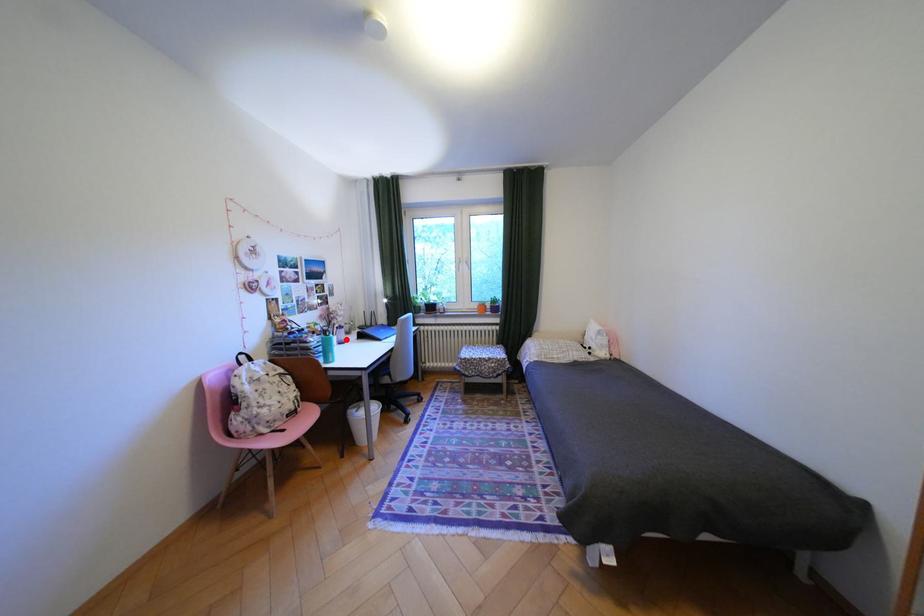
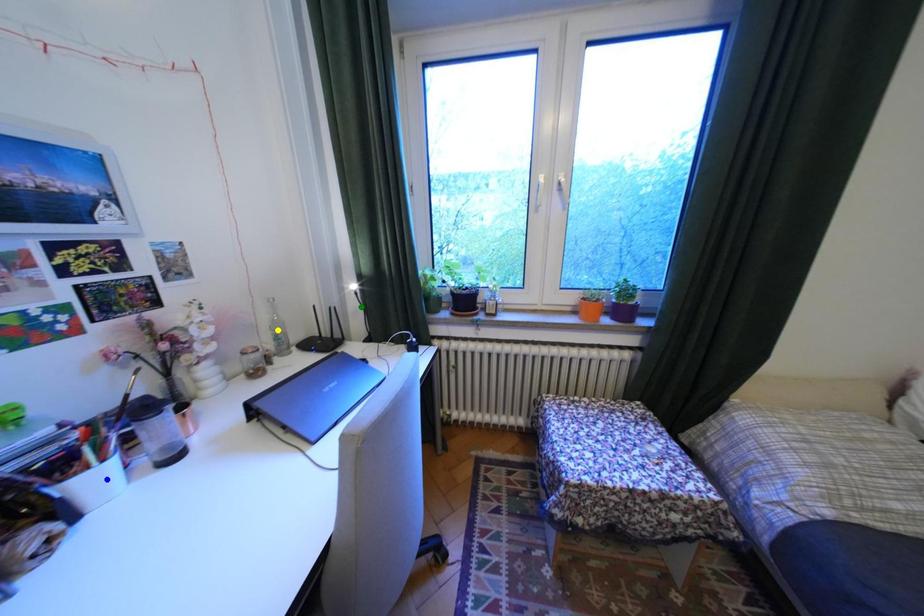
Question: I am providing you with two images of the same scene from different viewpoints. A red point is marked on the first image. You are given multiple points on the second image. Can you choose the point in image 2 that corresponds to the point in image 1?

Choices:
 (A) green point
 (B) yellow point
 (C) blue point

Answer: (C)